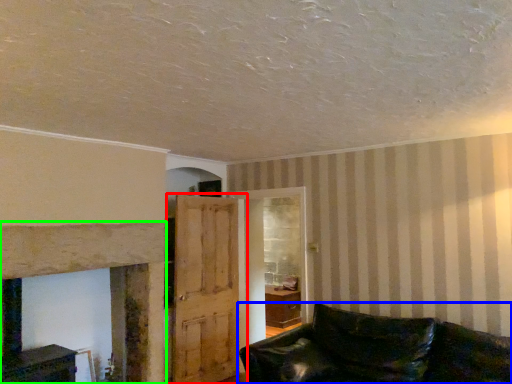
Question: Considering the real-world distances, which object is farthest from door (highlighted by a red box)? studio couch (highlighted by a blue box) or fireplace (highlighted by a green box)?

Choices:
 (A) studio couch
 (B) fireplace

Answer: (A)